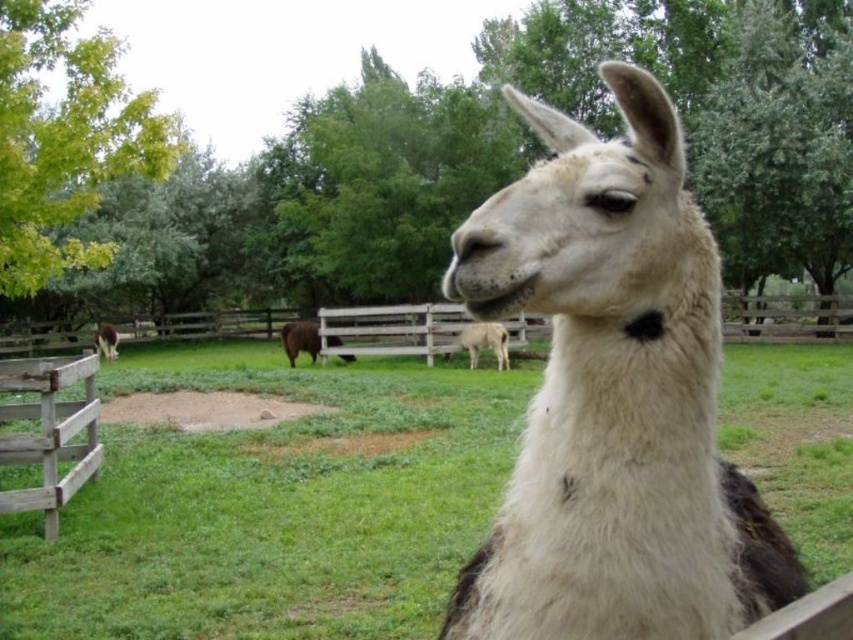
Question: Which object appears farthest from the camera in this image?

Choices:
 (A) green grass at center
 (B) white woolen alpaca at center
 (C) wooden fence at center
 (D) brown woolly sheep at center

Answer: (D)

Question: Is brown woolly sheep at center below brown woolly llama at center?

Choices:
 (A) yes
 (B) no

Answer: (B)

Question: Does green grass at center lie in front of brown woolly llama at center?

Choices:
 (A) no
 (B) yes

Answer: (B)

Question: Which of the following is the farthest from the observer?

Choices:
 (A) white woolen goat at center
 (B) white woolen alpaca at center
 (C) brown woolly sheep at center

Answer: (C)

Question: Which point is closer to the camera taking this photo?

Choices:
 (A) (399, 566)
 (B) (106, 326)
 (C) (729, 292)
 (D) (666, 460)

Answer: (D)

Question: Is white woolen alpaca at center to the left of wooden fence at center from the viewer's perspective?

Choices:
 (A) no
 (B) yes

Answer: (A)